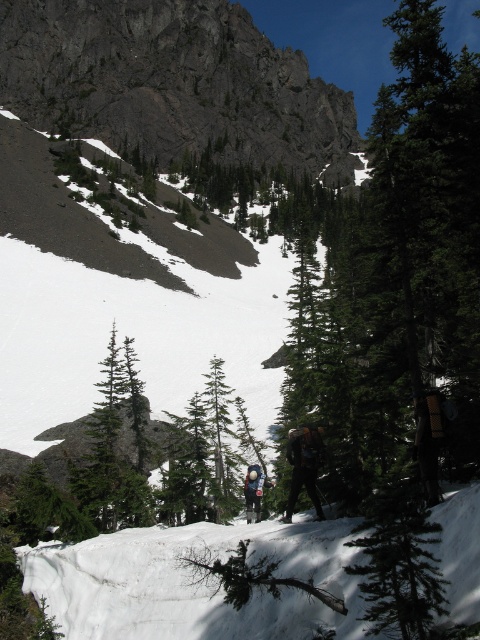
Can you confirm if green textured tree at center is smaller than blue fabric backpack at center?

Incorrect, green textured tree at center is not smaller in size than blue fabric backpack at center.

Does green textured tree at center have a lesser height compared to blue fabric backpack at center?

Yes.

Is point (375, 618) more distant than point (253, 497)?

That is False.

Find the location of a particular element. This screenshot has width=480, height=640. green textured tree at center is located at coordinates (398, 563).

Who is more distant from viewer, (x=8, y=100) or (x=303, y=476)?

The point (x=8, y=100) is more distant.

Is rugged granite mountain at upper center shorter than dark green fabric jacket at center?

Incorrect, rugged granite mountain at upper center's height does not fall short of dark green fabric jacket at center's.

Between point (14, 77) and point (320, 440), which one is positioned behind?

Point (14, 77)

Locate an element on the screen. rugged granite mountain at upper center is located at coordinates (172, 83).

Is dark green fabric jacket at center thinner than blue fabric backpack at center?

No.

Which is behind, point (308, 472) or point (262, 481)?

The point (262, 481) is more distant.

Is point (305, 468) closer to camera compared to point (251, 481)?

Yes, it is.

Where is `dark green fabric jacket at center`? Image resolution: width=480 pixels, height=640 pixels. dark green fabric jacket at center is located at coordinates (303, 465).